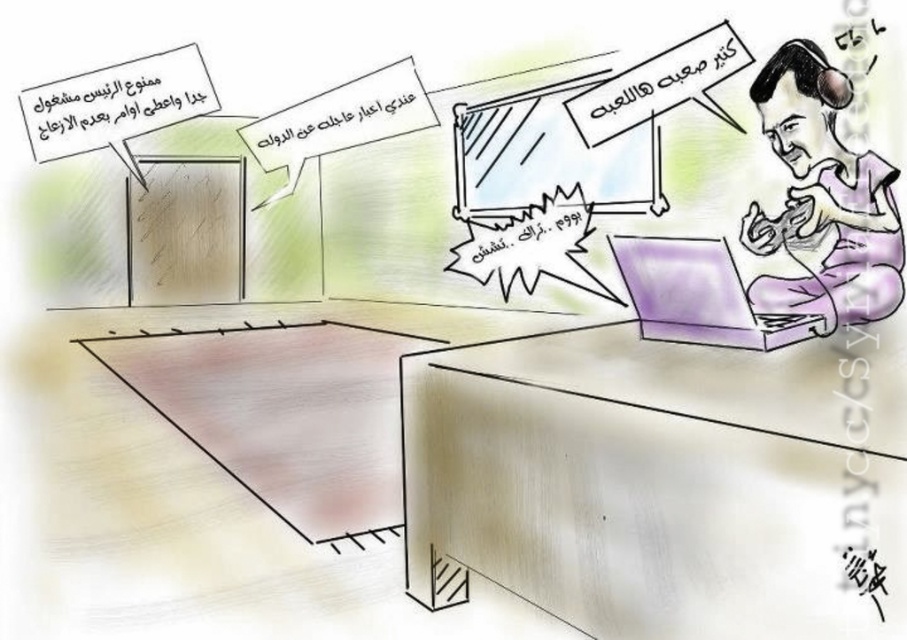
Does purple matte laptop at right have a lesser width compared to white paper sign at upper right?

In fact, purple matte laptop at right might be wider than white paper sign at upper right.

Is purple matte laptop at right above white paper sign at upper right?

Incorrect, purple matte laptop at right is not positioned above white paper sign at upper right.

At what (x,y) coordinates should I click in order to perform the action: click on purple matte laptop at right. Please return your answer as a coordinate pair (x, y). Looking at the image, I should click on (703, 296).

This screenshot has width=907, height=640. In order to click on purple matte laptop at right in this screenshot , I will do `click(703, 296)`.

Is purple matte shirt at upper right wider than white paper sign at upper center?

No, purple matte shirt at upper right is not wider than white paper sign at upper center.

In order to click on purple matte shirt at upper right in this screenshot , I will do `click(822, 198)`.

Who is higher up, white paper sign at upper center or white paper sign at upper right?

white paper sign at upper center is higher up.

Can you confirm if white paper sign at upper center is positioned below white paper sign at upper right?

Incorrect, white paper sign at upper center is not positioned below white paper sign at upper right.

Between point (288, 156) and point (736, 45), which one is positioned behind?

Positioned behind is point (288, 156).

At what (x,y) coordinates should I click in order to perform the action: click on white paper sign at upper center. Please return your answer as a coordinate pair (x, y). This screenshot has height=640, width=907. Looking at the image, I should click on (340, 118).